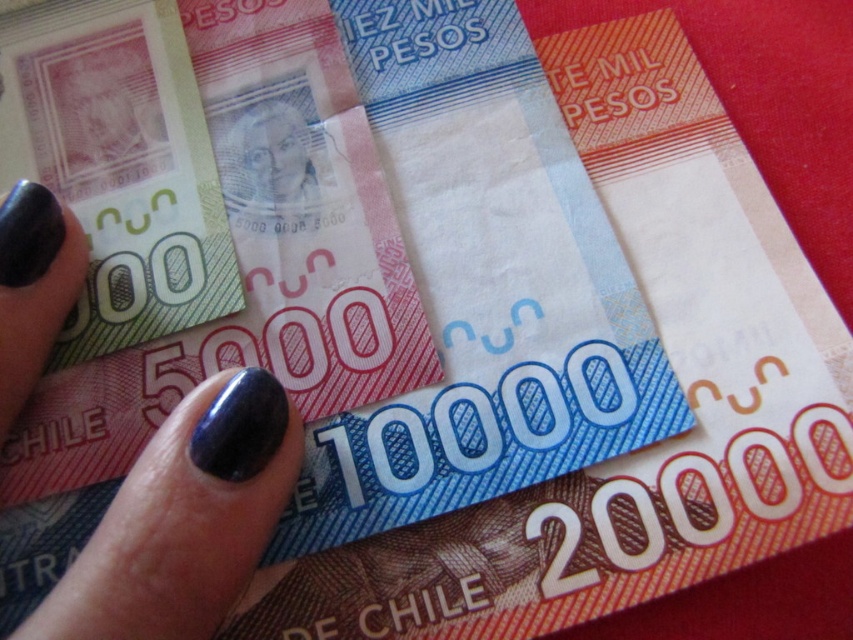
In the scene shown: Which is more to the right, nail polish at lower left or smooth paper money at center?

smooth paper money at center is more to the right.

Is nail polish at lower left below smooth paper money at center?

Correct, nail polish at lower left is located below smooth paper money at center.

Who is more distant from viewer, (61,259) or (314,211)?

Point (314,211)

This screenshot has width=853, height=640. Identify the location of nail polish at lower left. (33, 285).

Which is below, nail polish at center or smooth paper money at center?

nail polish at center is lower down.

Between point (242, 518) and point (247, 173), which one is positioned behind?

The point (247, 173) is more distant.

Where is `nail polish at center`? nail polish at center is located at coordinates click(x=183, y=518).

Looking at this image, does nail polish at center have a larger size compared to nail polish at lower left?

Correct, nail polish at center is larger in size than nail polish at lower left.

Who is more forward, (16,634) or (88,246)?

Point (16,634) is more forward.

Where is `nail polish at center`? This screenshot has width=853, height=640. nail polish at center is located at coordinates (183, 518).